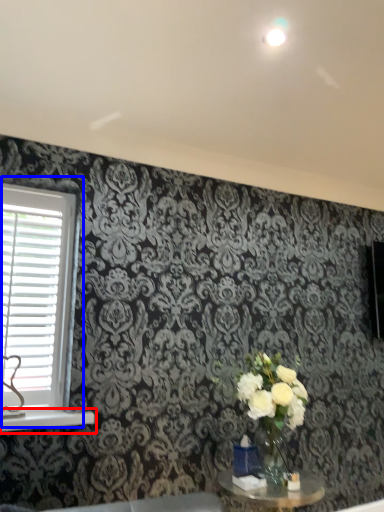
Question: Which object is further to the camera taking this photo, window sill (highlighted by a red box) or window (highlighted by a blue box)?

Choices:
 (A) window sill
 (B) window

Answer: (B)